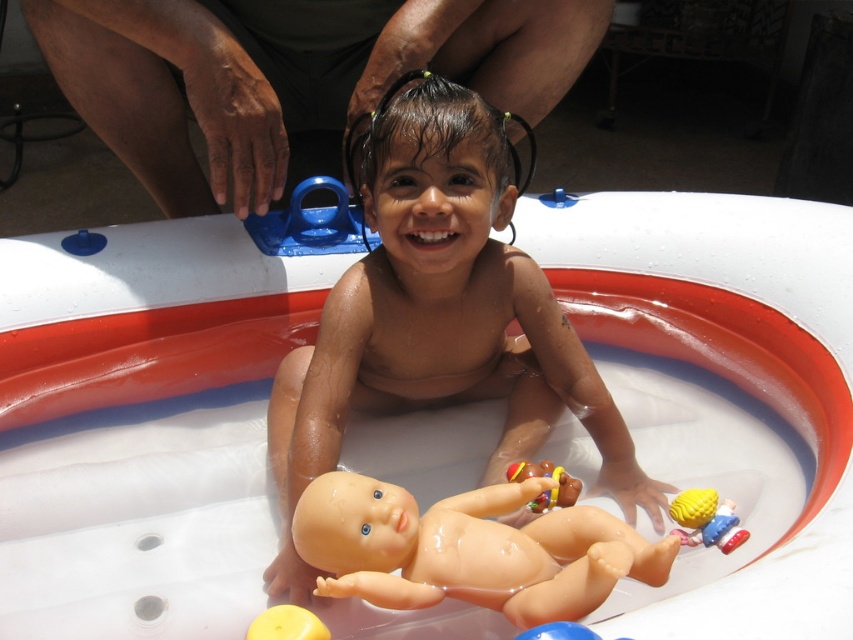
Which of these two, smooth tan skin at center or brown skin at upper center, stands taller?

smooth tan skin at center is taller.

Who is lower down, smooth tan skin at center or brown skin at upper center?

Positioned lower is smooth tan skin at center.

Does point (503, 291) come farther from viewer compared to point (518, 92)?

No, it is not.

Locate an element on the screen. smooth tan skin at center is located at coordinates (438, 314).

Can you confirm if white rubber bath at center is thinner than yellow rubber ball at lower center?

No, white rubber bath at center is not thinner than yellow rubber ball at lower center.

Is point (799, 273) positioned in front of point (303, 609)?

That is False.

The height and width of the screenshot is (640, 853). In order to click on white rubber bath at center in this screenshot , I will do `click(712, 250)`.

Is white rubber bath at center to the left of rubber baby doll at center from the viewer's perspective?

Incorrect, white rubber bath at center is not on the left side of rubber baby doll at center.

The image size is (853, 640). Describe the element at coordinates (712, 250) in the screenshot. I see `white rubber bath at center` at that location.

At what (x,y) coordinates should I click in order to perform the action: click on white rubber bath at center. Please return your answer as a coordinate pair (x, y). The height and width of the screenshot is (640, 853). Looking at the image, I should click on (712, 250).